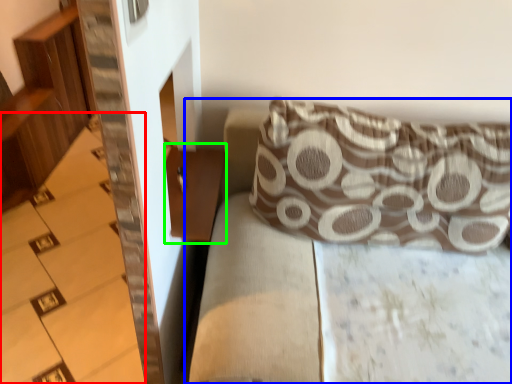
Question: Considering the real-world distances, which object is farthest from stairwell (highlighted by a red box)? couch (highlighted by a blue box) or table (highlighted by a green box)?

Choices:
 (A) couch
 (B) table

Answer: (A)